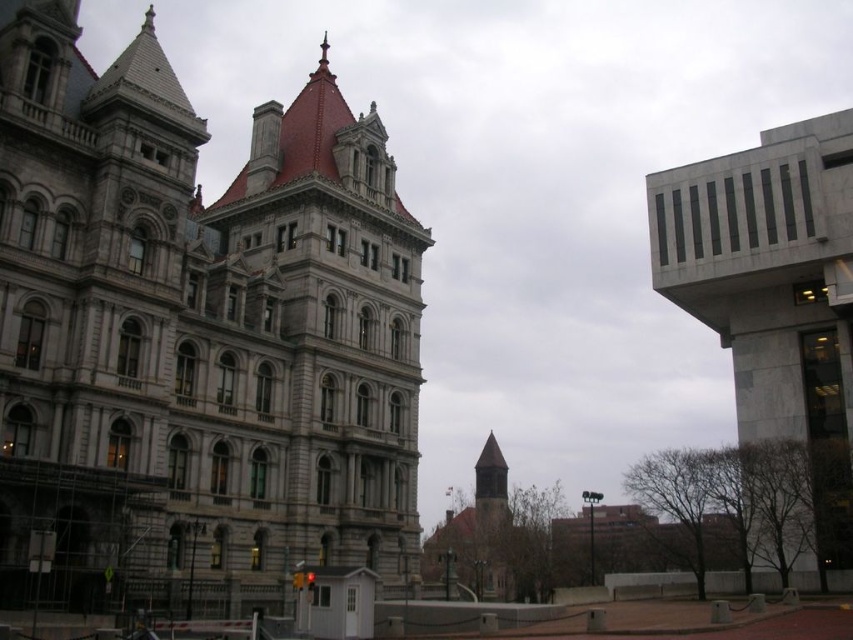
You are a drone operator trying to capture aerial footage of the gray stone tower at center. Your drone is currently hovering at point (302, 353). Is this point the correct location to capture the tower?

Yes, the point (302, 353) indicates the gray stone tower at center, so hovering there will allow you to capture the tower.

You are standing in front of the historic building and want to take a photo that includes both the historic building and the modern structure. Which of the two points, point (335,243) or point (751,317), is closer to you?

Point (335,243) is closer to the camera than point (751,317), so it is closer to you.